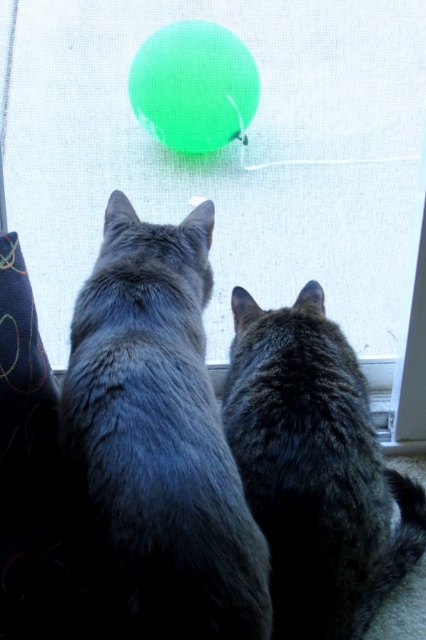
Consider the image. Who is shorter, transparent plastic screen door at upper center or dark gray fur cat at center?

Standing shorter between the two is dark gray fur cat at center.

How much distance is there between transparent plastic screen door at upper center and dark gray fur cat at center?

They are 46.33 centimeters apart.

Locate an element on the screen. transparent plastic screen door at upper center is located at coordinates (235, 161).

Is dark gray fur cat at center shorter than green rubber ball at upper center?

In fact, dark gray fur cat at center may be taller than green rubber ball at upper center.

Which is more to the right, dark gray fur cat at center or green rubber ball at upper center?

From the viewer's perspective, dark gray fur cat at center appears more on the right side.

Image resolution: width=426 pixels, height=640 pixels. Find the location of `dark gray fur cat at center`. dark gray fur cat at center is located at coordinates (316, 468).

Locate an element on the screen. This screenshot has height=640, width=426. dark gray fur cat at center is located at coordinates (316, 468).

Can you confirm if transparent plastic screen door at upper center is positioned below gray fluffy cat at center?

No.

Which is more to the left, transparent plastic screen door at upper center or gray fluffy cat at center?

Positioned to the left is gray fluffy cat at center.

Who is more distant from viewer, (261, 45) or (149, 262)?

The point (261, 45) is more distant.

Identify the location of transparent plastic screen door at upper center. This screenshot has width=426, height=640. (x=235, y=161).